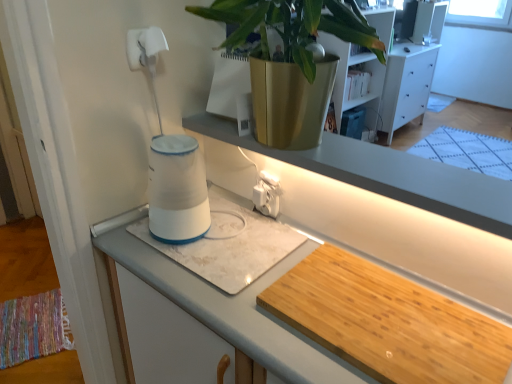
Question: From the image's perspective, is white glossy dresser at upper right under wooden cutting board at lower right, which is the 2th wide from left to right?

Choices:
 (A) yes
 (B) no

Answer: (B)

Question: Considering the relative sizes of white glossy dresser at upper right and wooden cutting board at lower right, which is the 2th wide from left to right, in the image provided, is white glossy dresser at upper right shorter than wooden cutting board at lower right, which is the 2th wide from left to right,?

Choices:
 (A) no
 (B) yes

Answer: (A)

Question: Is white glossy dresser at upper right completely or partially outside of wooden cutting board at lower right, which is the 2th wide from left to right?

Choices:
 (A) yes
 (B) no

Answer: (A)

Question: Is wooden cutting board at lower right, which is the 2th wide from left to right, at the back of white glossy dresser at upper right?

Choices:
 (A) no
 (B) yes

Answer: (A)

Question: Can you confirm if white glossy dresser at upper right is smaller than wooden cutting board at lower right, which ranks as the 1th wide in right-to-left order?

Choices:
 (A) yes
 (B) no

Answer: (B)

Question: Is white glossy dresser at upper right far away from wooden cutting board at lower right, which is the 2th wide from left to right?

Choices:
 (A) yes
 (B) no

Answer: (A)

Question: Considering the relative positions of white glossy cup at center, placed as the 2th wide when sorted from right to left, and white plastic electric outlet at center in the image provided, is white glossy cup at center, placed as the 2th wide when sorted from right to left, to the right of white plastic electric outlet at center from the viewer's perspective?

Choices:
 (A) yes
 (B) no

Answer: (B)

Question: Does white glossy cup at center, which is counted as the 1th wide, starting from the left, lie in front of white plastic electric outlet at center?

Choices:
 (A) yes
 (B) no

Answer: (A)

Question: Can you confirm if white glossy cup at center, which is counted as the 1th wide, starting from the left, is taller than white plastic electric outlet at center?

Choices:
 (A) no
 (B) yes

Answer: (A)

Question: Is white glossy cup at center, placed as the 2th wide when sorted from right to left, looking in the opposite direction of white plastic electric outlet at center?

Choices:
 (A) no
 (B) yes

Answer: (A)

Question: From a real-world perspective, is white glossy cup at center, which is counted as the 1th wide, starting from the left, positioned over white plastic electric outlet at center based on gravity?

Choices:
 (A) no
 (B) yes

Answer: (A)

Question: Considering the relative positions of white glossy cup at center, which is counted as the 1th wide, starting from the left, and white plastic electric outlet at center in the image provided, is white glossy cup at center, which is counted as the 1th wide, starting from the left, to the left of white plastic electric outlet at center from the viewer's perspective?

Choices:
 (A) no
 (B) yes

Answer: (B)

Question: Is white plastic electric outlet at center facing towards white glossy cup at center, placed as the 2th wide when sorted from right to left?

Choices:
 (A) yes
 (B) no

Answer: (A)